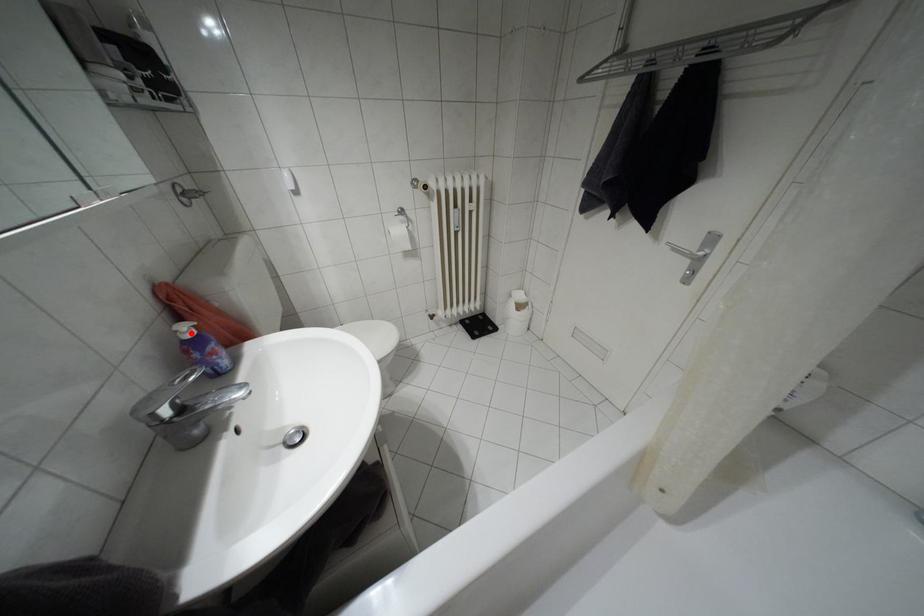
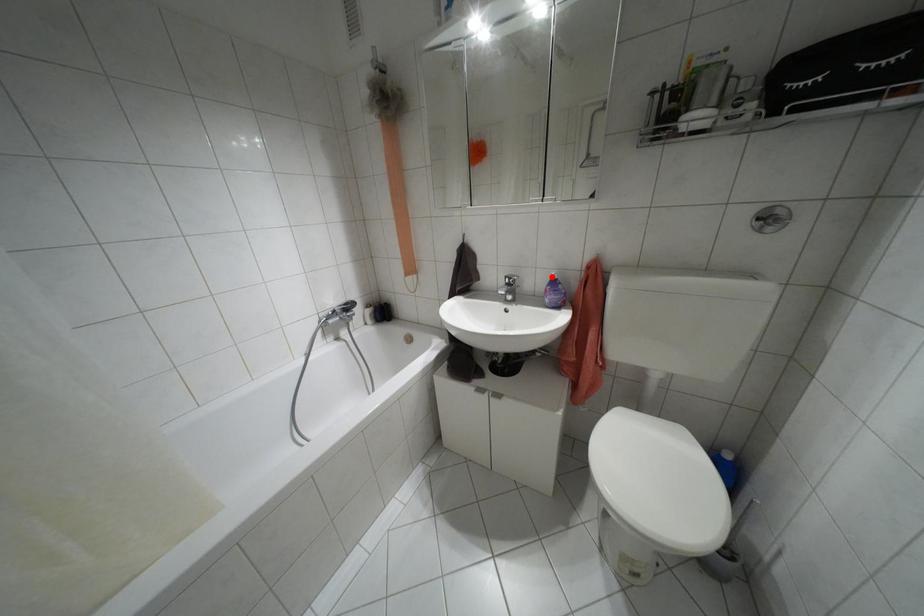
I am providing you with two images of the same scene from different viewpoints. A red point is marked on the first image and another point is marked on the second image. Do the highlighted points in image1 and image2 indicate the same real-world spot?

Yes